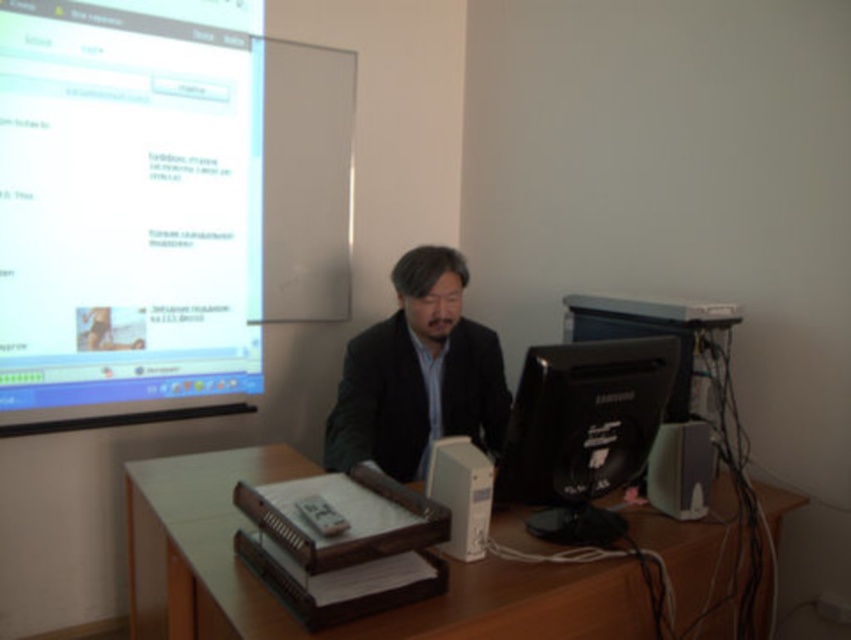
Question: Is brown wooden table at center smaller than black glossy monitor at center?

Choices:
 (A) yes
 (B) no

Answer: (B)

Question: Where is black matte suit at center located in relation to black glossy monitor at center in the image?

Choices:
 (A) right
 (B) left

Answer: (B)

Question: Which point appears closest to the camera in this image?

Choices:
 (A) (580, 317)
 (B) (44, 292)

Answer: (B)

Question: Which point is farther from the camera taking this photo?

Choices:
 (A) (341, 420)
 (B) (583, 492)

Answer: (A)

Question: Does black matte suit at center have a larger size compared to black glossy monitor at center?

Choices:
 (A) no
 (B) yes

Answer: (B)

Question: Which point is closer to the camera?

Choices:
 (A) black plastic monitor at center
 (B) brown wooden table at center

Answer: (B)